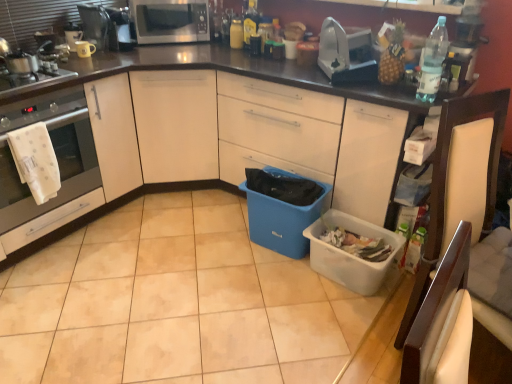
Locate an element on the screen. The height and width of the screenshot is (384, 512). free location in front of white plastic storage box at lower right, the 2th storage box from the left is located at coordinates (339, 322).